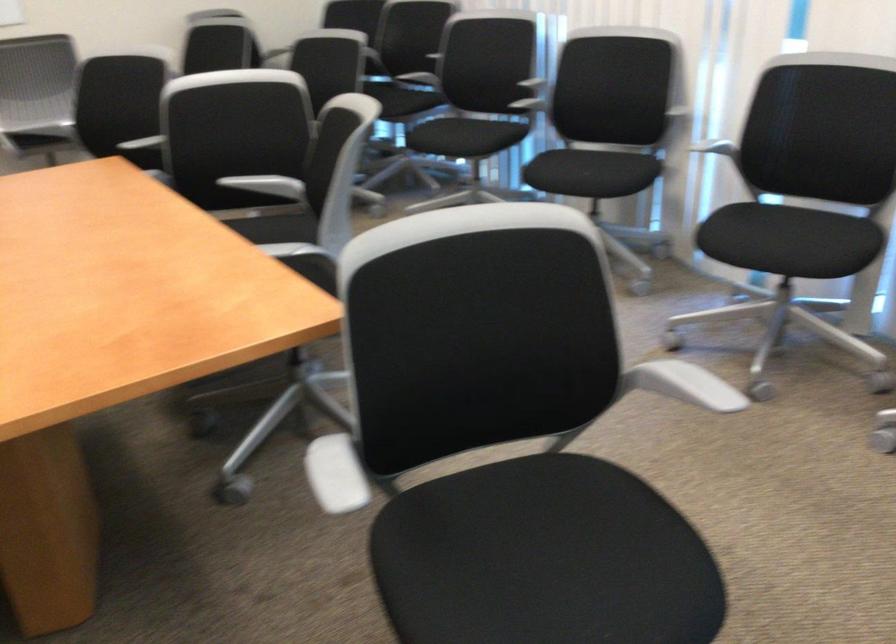
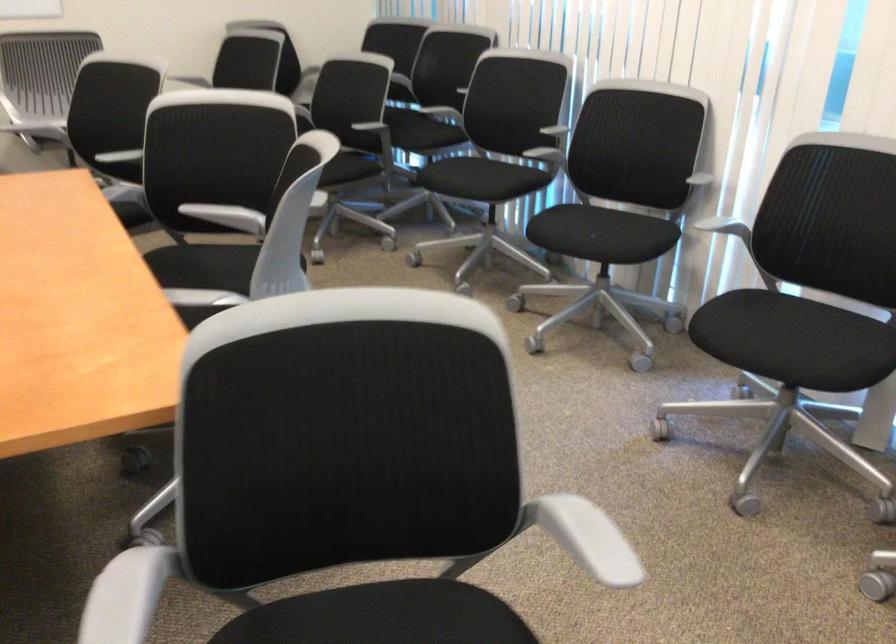
The point at (x=712, y=145) is marked in the first image. Where is the corresponding point in the second image?

(725, 228)